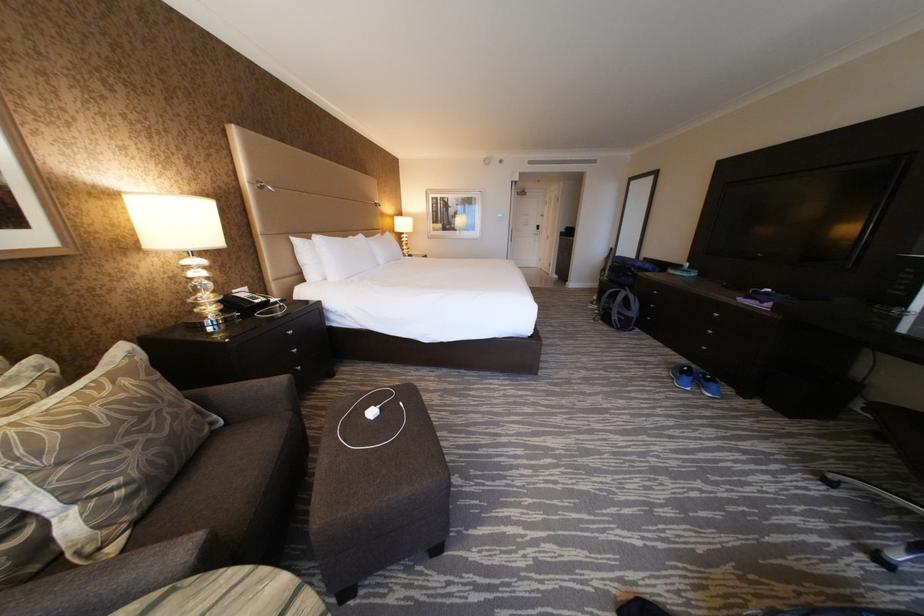
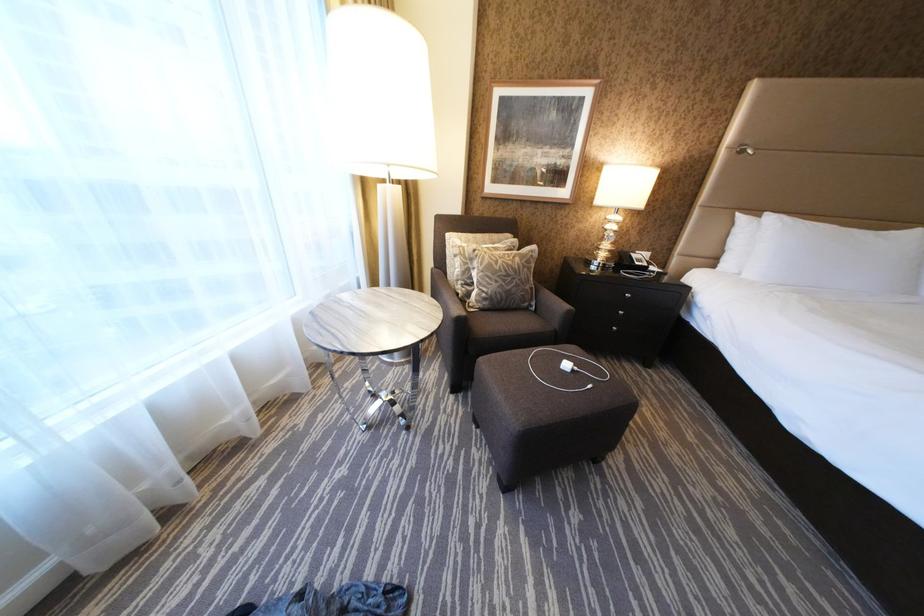
Based on the continuous images, in which direction is the camera rotating?

The camera's rotation is toward left-down.